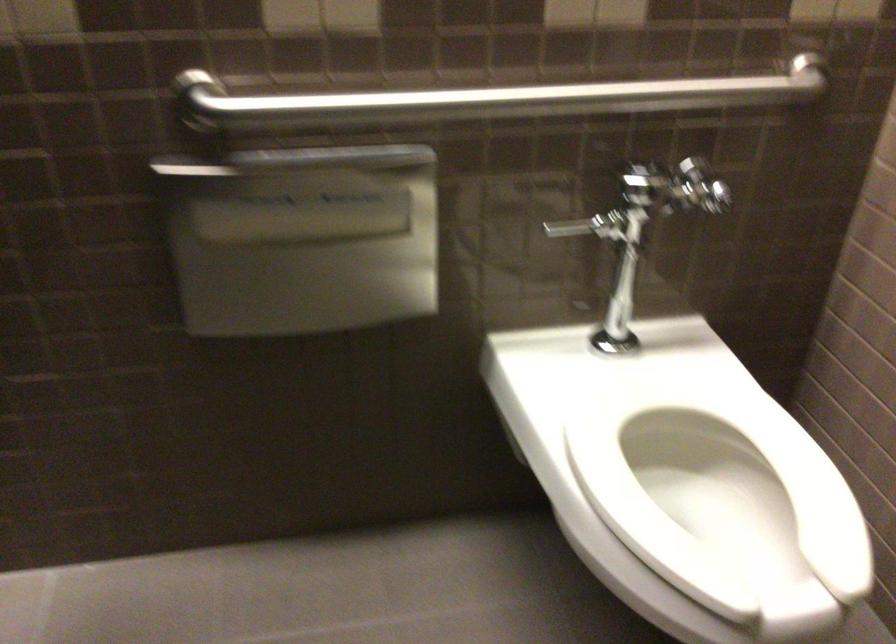
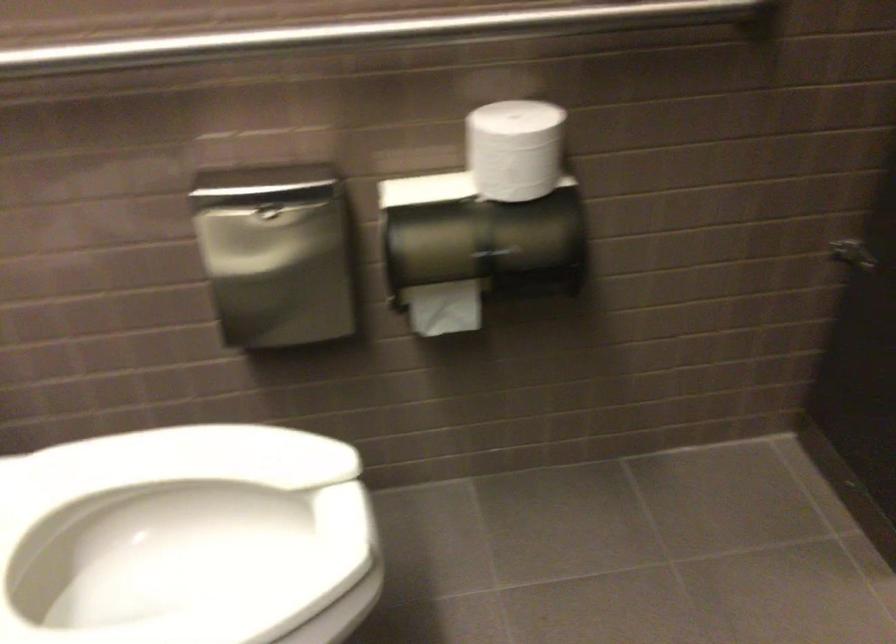
Locate, in the second image, the point that corresponds to point 753,526 in the first image.

(186, 538)